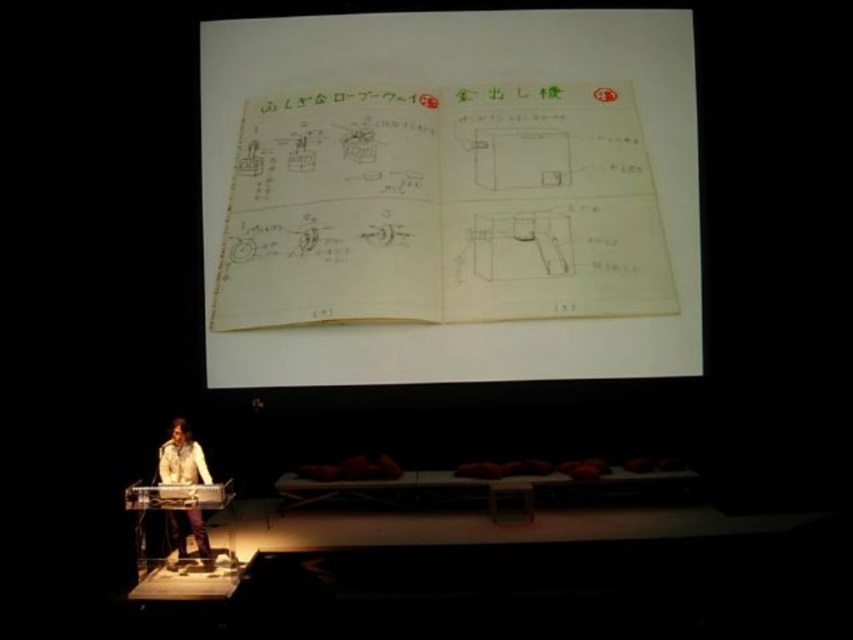
You are an audience member sitting in the front row of the stage. You notice two points on the projection screen. The first point is at coordinate point (558, 268) and the second is at coordinate point (193, 508). From your perspective, which point is closer to you?

Point (193, 508) is closer to you because the description states that point (558, 268) is behind point (193, 508).

You are an attendee at the presentation and want to take notes. The presenter is using the keyboard instrument on stage. Which object is closer to you, the yellow paper notebook at center or the light brown leather jacket at lower left?

The light brown leather jacket at lower left is behind the yellow paper notebook at center, so the yellow paper notebook at center is closer to you.